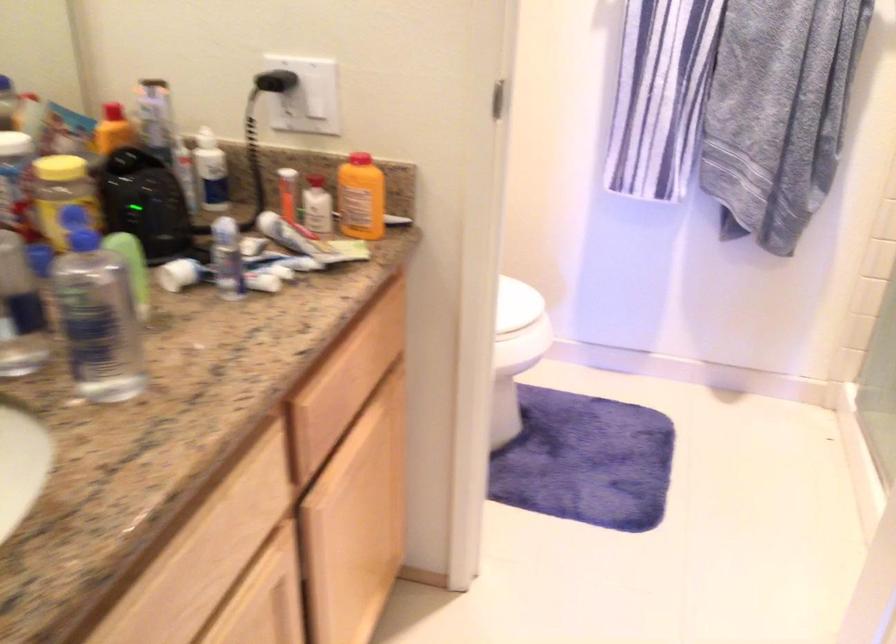
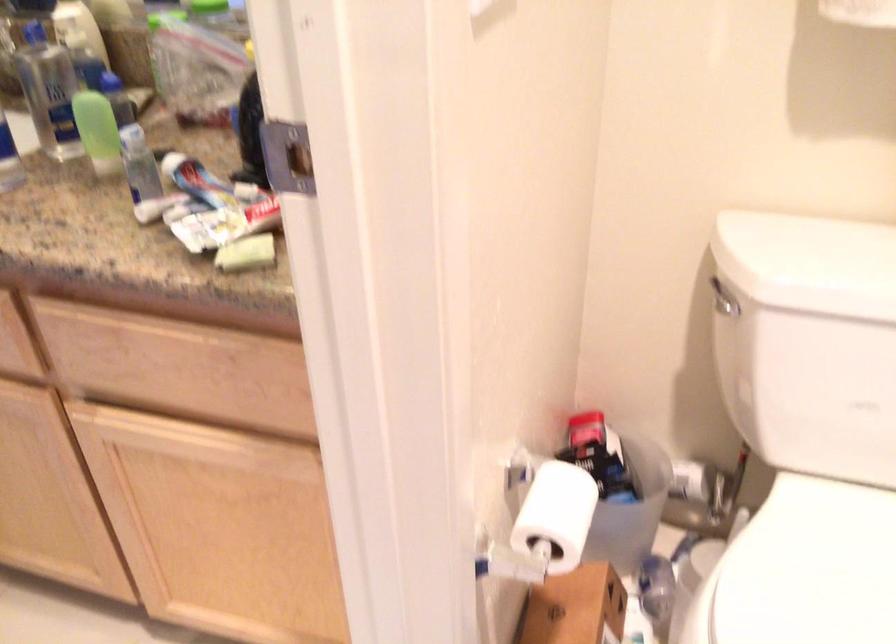
Where in the second image is the point corresponding to (359,375) from the first image?

(177, 368)